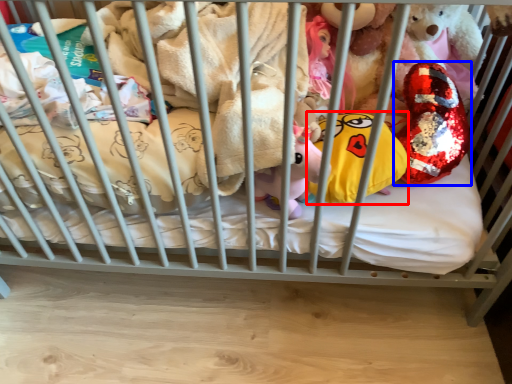
Question: Among these objects, which one is nearest to the camera, pillow (highlighted by a red box) or toy (highlighted by a blue box)?

Choices:
 (A) pillow
 (B) toy

Answer: (A)